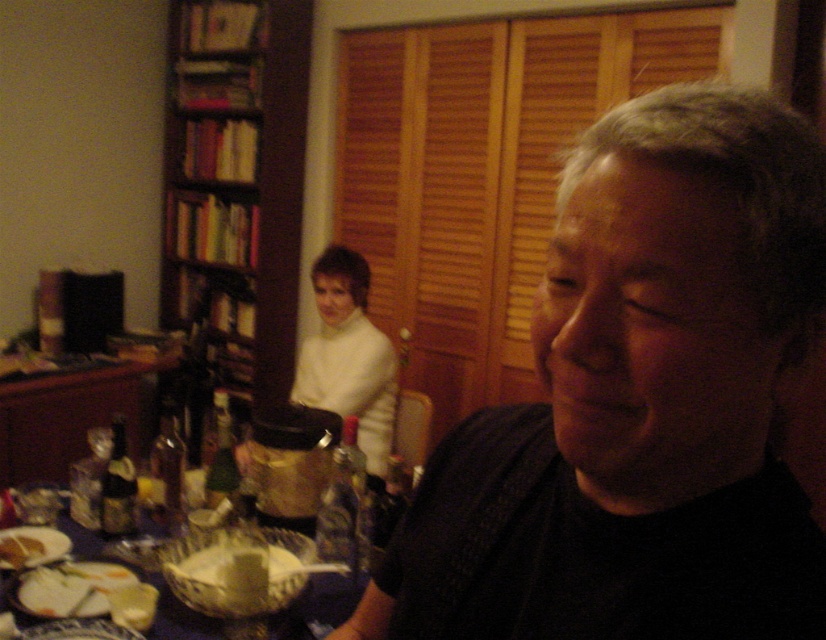
Question: Observing the image, what is the correct spatial positioning of black matte shirt at center in reference to plastic bowl at lower left?

Choices:
 (A) above
 (B) below

Answer: (A)

Question: Considering the relative positions of black matte shirt at center and wooden bookshelf at left in the image provided, where is black matte shirt at center located with respect to wooden bookshelf at left?

Choices:
 (A) below
 (B) above

Answer: (A)

Question: Considering the relative positions of white sweater at center and plastic bowl at lower left in the image provided, where is white sweater at center located with respect to plastic bowl at lower left?

Choices:
 (A) below
 (B) above

Answer: (B)

Question: Among these objects, which one is nearest to the camera?

Choices:
 (A) white creamy bread at lower left
 (B) black matte shirt at center
 (C) white sweater at center
 (D) wooden bookshelf at left

Answer: (B)

Question: Which of the following is the farthest from the observer?

Choices:
 (A) plastic bowl at lower left
 (B) black matte shirt at center
 (C) white sweater at center

Answer: (C)

Question: Which object is the farthest from the wooden bookshelf at left?

Choices:
 (A) white creamy bread at lower left
 (B) black matte shirt at center
 (C) white sweater at center

Answer: (B)